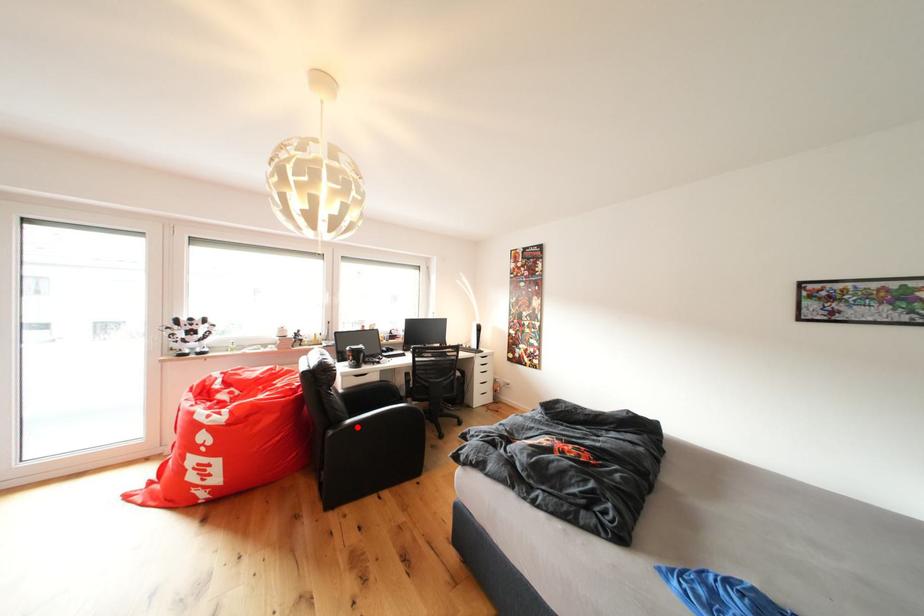
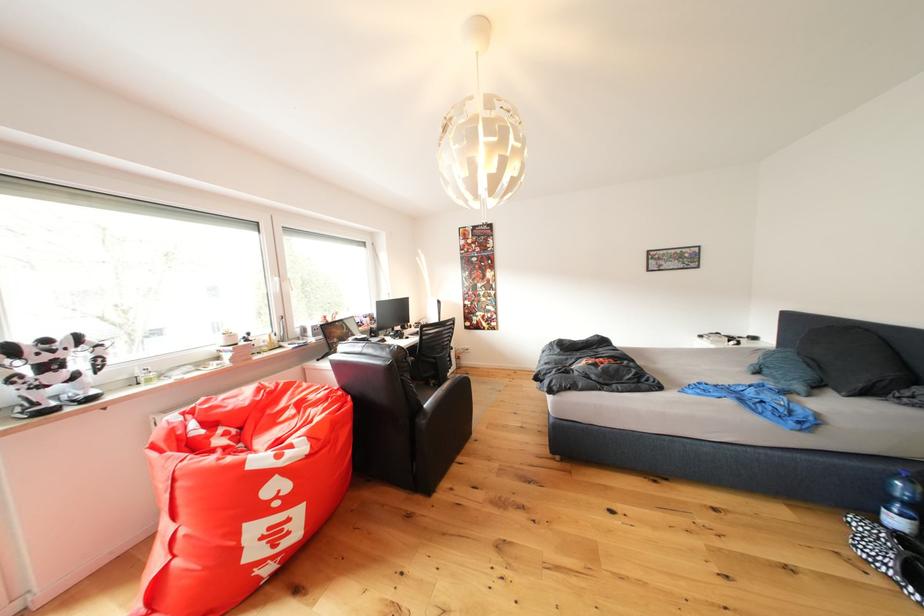
Find the pixel in the second image that matches the highlighted location in the first image.

(434, 410)